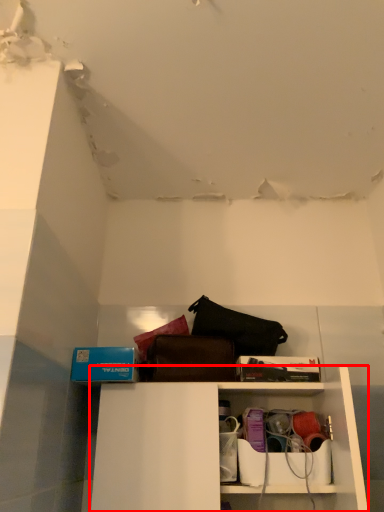
Question: From the image's perspective, where is shelf (annotated by the red box) located in relation to cabinet in the image?

Choices:
 (A) below
 (B) above

Answer: (B)